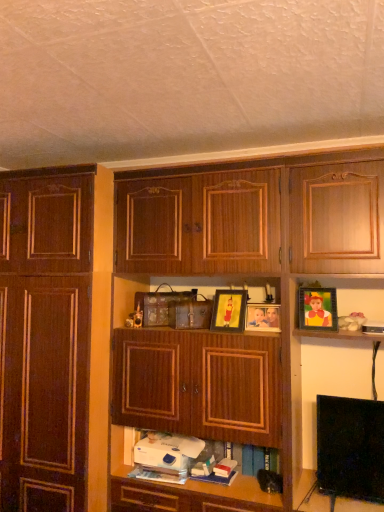
Question: Considering the relative positions of white matte book at lower center, the second book viewed from the right, and wooden cabinet at center, arranged as the second cabinetry when viewed from the left, in the image provided, is white matte book at lower center, the second book viewed from the right, behind wooden cabinet at center, arranged as the second cabinetry when viewed from the left,?

Choices:
 (A) yes
 (B) no

Answer: (A)

Question: Does white matte book at lower center, the 1th book from the left, have a lesser height compared to wooden cabinet at center, the 1th cabinetry from the right?

Choices:
 (A) yes
 (B) no

Answer: (A)

Question: From the image's perspective, is white matte book at lower center, the second book viewed from the right, beneath wooden cabinet at center, the 1th cabinetry from the right?

Choices:
 (A) no
 (B) yes

Answer: (B)

Question: Is white matte book at lower center, the 1th book from the left, to the right of wooden cabinet at center, the 1th cabinetry from the right, from the viewer's perspective?

Choices:
 (A) no
 (B) yes

Answer: (A)

Question: Does white matte book at lower center, the 1th book from the left, have a smaller size compared to wooden cabinet at center, arranged as the second cabinetry when viewed from the left?

Choices:
 (A) yes
 (B) no

Answer: (A)

Question: Is wooden cabinet at center, arranged as the second cabinetry when viewed from the left, at the back of white matte book at lower center, the second book viewed from the right?

Choices:
 (A) no
 (B) yes

Answer: (B)

Question: Considering the relative sizes of metallic gold picture frame at upper right, positioned as the 1th picture frame in right-to-left order, and white matte book at center, positioned as the 1th book in right-to-left order, in the image provided, is metallic gold picture frame at upper right, positioned as the 1th picture frame in right-to-left order, shorter than white matte book at center, positioned as the 1th book in right-to-left order,?

Choices:
 (A) no
 (B) yes

Answer: (A)

Question: From the image's perspective, is metallic gold picture frame at upper right, which is the 3th picture frame from left to right, on white matte book at center, positioned as the 1th book in right-to-left order?

Choices:
 (A) yes
 (B) no

Answer: (A)

Question: Is metallic gold picture frame at upper right, positioned as the 1th picture frame in right-to-left order, oriented towards white matte book at center, the second book in the left-to-right sequence?

Choices:
 (A) yes
 (B) no

Answer: (B)

Question: Can you confirm if metallic gold picture frame at upper right, which is the 3th picture frame from left to right, is wider than white matte book at center, positioned as the 1th book in right-to-left order?

Choices:
 (A) no
 (B) yes

Answer: (A)

Question: From a real-world perspective, is metallic gold picture frame at upper right, which is the 3th picture frame from left to right, beneath white matte book at center, the second book in the left-to-right sequence?

Choices:
 (A) no
 (B) yes

Answer: (A)

Question: Is metallic gold picture frame at upper right, positioned as the 1th picture frame in right-to-left order, taller than white matte book at center, the second book in the left-to-right sequence?

Choices:
 (A) no
 (B) yes

Answer: (B)

Question: Is the position of metallic gold picture frame at upper right, positioned as the 1th picture frame in right-to-left order, more distant than that of dark wood cabinet at left, acting as the 2th cabinetry starting from the right?

Choices:
 (A) yes
 (B) no

Answer: (A)